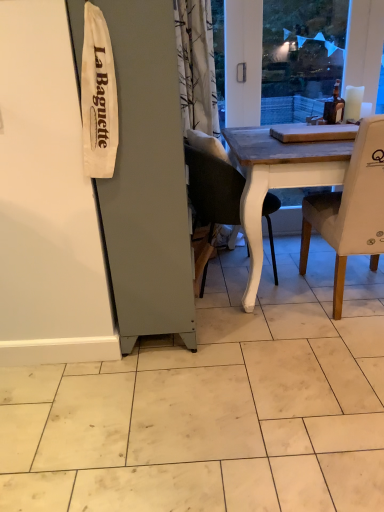
Find the location of a particular element. The height and width of the screenshot is (512, 384). free space in front of white fabric chair at right, which ranks as the 2th chair in left-to-right order is located at coordinates (337, 358).